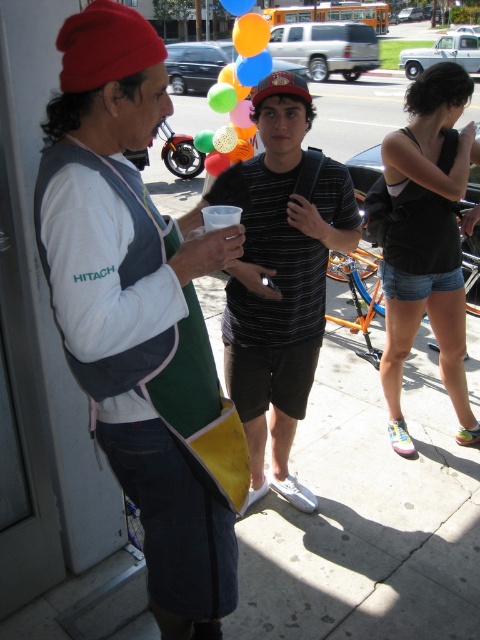
Does striped cotton shirt at center come behind multicolored balloons at center?

No.

Does striped cotton shirt at center have a lesser height compared to multicolored balloons at center?

Indeed, striped cotton shirt at center has a lesser height compared to multicolored balloons at center.

In order to click on striped cotton shirt at center in this screenshot , I will do `click(283, 285)`.

Can you confirm if matte white shirt at left is positioned below multicolored balloons at center?

Yes, matte white shirt at left is below multicolored balloons at center.

Is matte white shirt at left behind multicolored balloons at center?

That is False.

Is point (176, 468) positioned before point (236, 115)?

That is True.

At what (x,y) coordinates should I click in order to perform the action: click on matte white shirt at left. Please return your answer as a coordinate pair (x, y). Looking at the image, I should click on (132, 300).

Which is more to the right, matte white shirt at left or striped cotton shirt at center?

striped cotton shirt at center is more to the right.

Is matte white shirt at left wider than striped cotton shirt at center?

No.

Does point (109, 241) lie in front of point (291, 404)?

Yes.

This screenshot has width=480, height=640. Identify the location of matte white shirt at left. (132, 300).